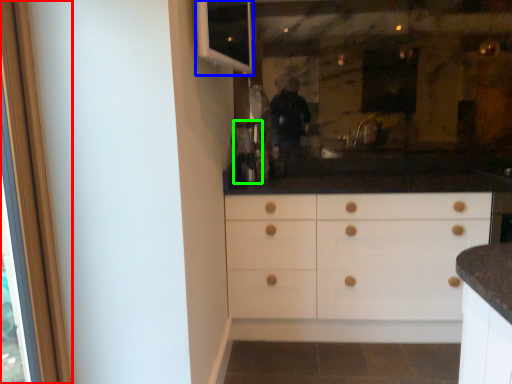
Question: Which object is the farthest from screen door (highlighted by a red box)? Choose among these: window (highlighted by a blue box) or coffee machine (highlighted by a green box).

Choices:
 (A) window
 (B) coffee machine

Answer: (B)